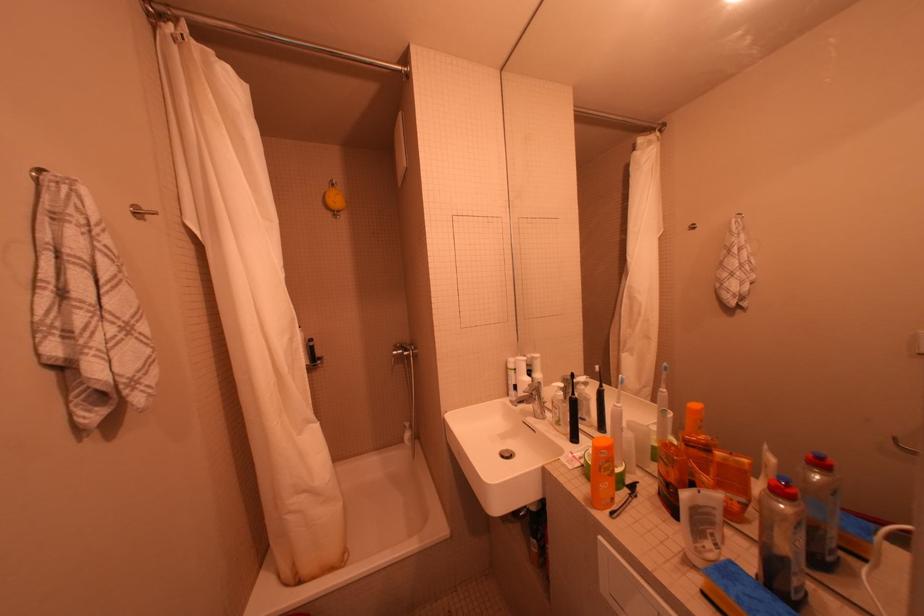
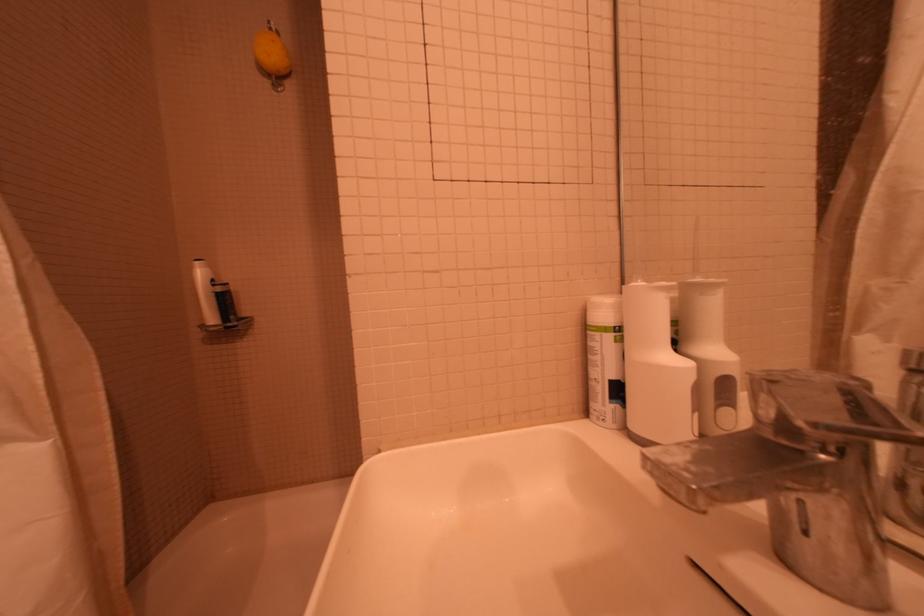
Question: The first image is from the beginning of the video and the second image is from the end. How did the camera likely rotate when shooting the video?

Choices:
 (A) Left
 (B) Right
 (C) Up
 (D) Down

Answer: (A)